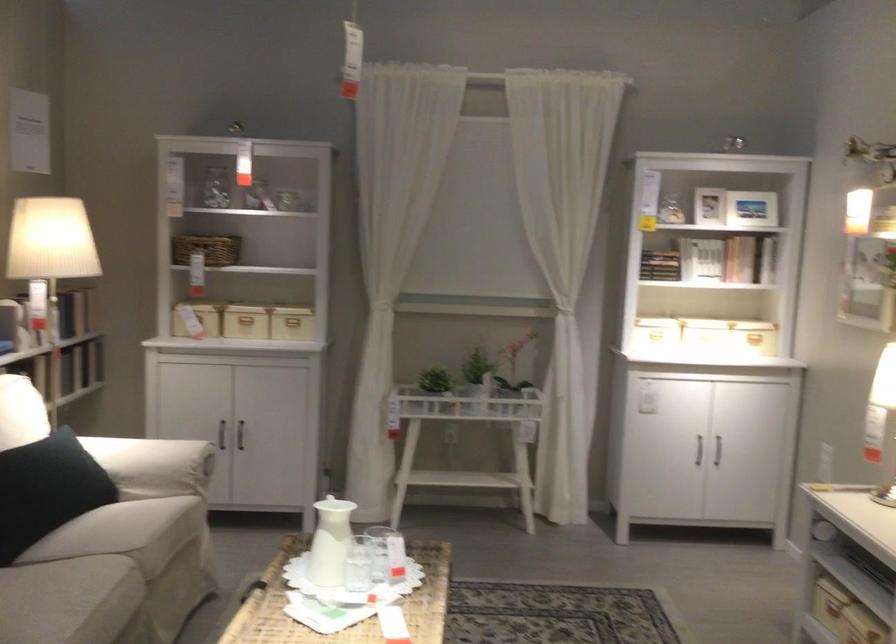
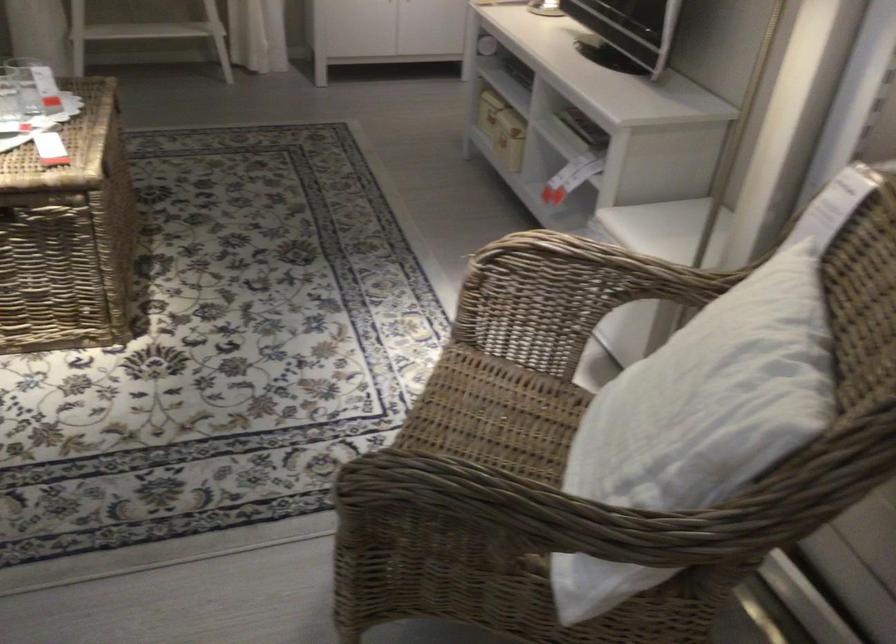
The first image is from the beginning of the video and the second image is from the end. How did the camera likely rotate when shooting the video?

The camera's rotation is toward right-down.